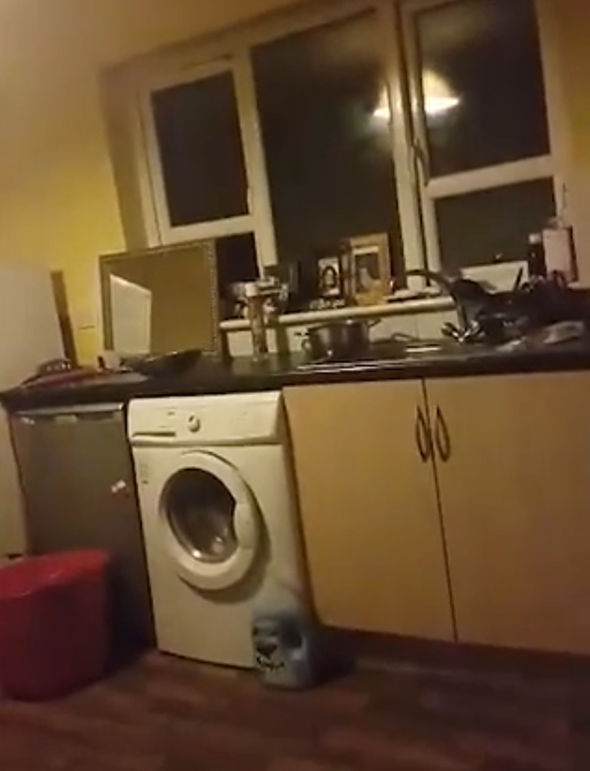
This screenshot has width=590, height=771. In order to click on windows in this screenshot , I will do `click(224, 167)`, `click(288, 156)`, `click(472, 146)`, `click(470, 224)`.